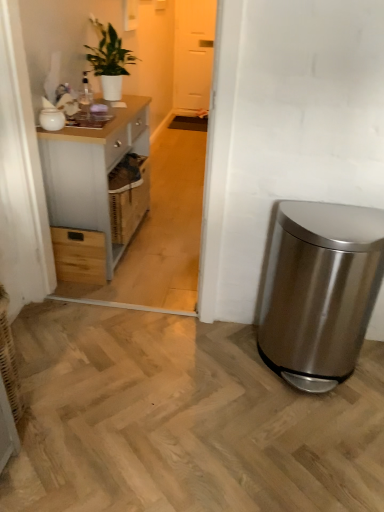
In order to face light gray wood cabinet at left, should I rotate leftwards or rightwards?

Rotate left and turn 11.498 degrees.

Describe the element at coordinates (320, 291) in the screenshot. I see `stainless steel trash can at lower right` at that location.

Locate an element on the screen. Image resolution: width=384 pixels, height=512 pixels. stainless steel trash can at lower right is located at coordinates (320, 291).

The image size is (384, 512). What do you see at coordinates (193, 53) in the screenshot?
I see `transparent glass door at upper center` at bounding box center [193, 53].

You are a GUI agent. You are given a task and a screenshot of the screen. Output one action in this format:
    pyautogui.click(x=<x>, y=<y>)
    Task: Click on the wooden drawer at left
    
    Given the screenshot: What is the action you would take?
    pyautogui.click(x=79, y=255)

I want to click on light gray wood cabinet at left, so click(91, 170).

Is white glossy jar at upper left with wooden drawer at left?

white glossy jar at upper left and wooden drawer at left are clearly separated.

Is point (39, 121) closer or farther from the camera than point (57, 278)?

Point (39, 121) is positioned closer to the camera compared to point (57, 278).

Based on the photo, do you think white glossy jar at upper left is within wooden drawer at left, or outside of it?

The correct answer is: outside.

Based on the photo, in terms of height, does white glossy jar at upper left look taller or shorter compared to wooden drawer at left?

Clearly, white glossy jar at upper left is shorter compared to wooden drawer at left.

What are the coordinates of `appliance that appears above the stainless steel trash can at lower right (from a real-world perspective)` in the screenshot? It's located at (52, 119).

Is stainless steel trash can at lower right not near white glossy jar at upper left?

Indeed, stainless steel trash can at lower right is not near white glossy jar at upper left.

From a real-world perspective, is stainless steel trash can at lower right positioned under white glossy jar at upper left based on gravity?

Indeed, from a real-world perspective, stainless steel trash can at lower right is positioned beneath white glossy jar at upper left.

Is white glossy jar at upper left a part of stainless steel trash can at lower right?

No.

Locate an element on the screen. This screenshot has width=384, height=512. glass door to the right of wooden drawer at left is located at coordinates (193, 53).

From the image's perspective, is transparent glass door at upper center located beneath wooden drawer at left?

No.

Would you consider transparent glass door at upper center to be distant from wooden drawer at left?

transparent glass door at upper center is positioned a significant distance from wooden drawer at left.

Is transparent glass door at upper center thinner than wooden drawer at left?

Correct, the width of transparent glass door at upper center is less than that of wooden drawer at left.

Considering the relative sizes of wooden drawer at left and stainless steel trash can at lower right in the image provided, is wooden drawer at left taller than stainless steel trash can at lower right?

No, wooden drawer at left is not taller than stainless steel trash can at lower right.

Is the surface of wooden drawer at left in direct contact with stainless steel trash can at lower right?

No, wooden drawer at left is not beside stainless steel trash can at lower right.

Based on the photo, from the image's perspective, which one is positioned higher, wooden drawer at left or stainless steel trash can at lower right?

wooden drawer at left is shown above in the image.

Would you consider white glossy jar at upper left to be distant from transparent glass door at upper center?

Indeed, white glossy jar at upper left is not near transparent glass door at upper center.

Is white glossy jar at upper left looking in the opposite direction of transparent glass door at upper center?

No.

Is point (46, 109) closer or farther from the camera than point (197, 36)?

Point (46, 109) appears to be closer to the viewer than point (197, 36).

Considering the relative sizes of green glossy plant at upper left and transparent glass door at upper center in the image provided, is green glossy plant at upper left taller than transparent glass door at upper center?

In fact, green glossy plant at upper left may be shorter than transparent glass door at upper center.

Is green glossy plant at upper left not near transparent glass door at upper center?

That's right, there is a large distance between green glossy plant at upper left and transparent glass door at upper center.

From the image's perspective, which one is positioned lower, green glossy plant at upper left or transparent glass door at upper center?

green glossy plant at upper left is shown below in the image.

From the image's perspective, who appears lower, transparent glass door at upper center or light gray wood cabinet at left?

light gray wood cabinet at left is shown below in the image.

Between transparent glass door at upper center and light gray wood cabinet at left, which one appears on the right side from the viewer's perspective?

transparent glass door at upper center is more to the right.

Is transparent glass door at upper center placed right next to light gray wood cabinet at left?

No, transparent glass door at upper center is not touching light gray wood cabinet at left.

From the picture: Is transparent glass door at upper center facing towards light gray wood cabinet at left?

Yes, transparent glass door at upper center is oriented towards light gray wood cabinet at left.

I want to click on appliance on the left of wooden drawer at left, so [52, 119].

The height and width of the screenshot is (512, 384). Identify the location of appliance that appears behind the stainless steel trash can at lower right. (52, 119).

Based on their spatial positions, is wooden drawer at left or stainless steel trash can at lower right closer to green glossy plant at upper left?

The object closer to green glossy plant at upper left is wooden drawer at left.

Based on their spatial positions, is wooden drawer at left or stainless steel trash can at lower right further from transparent glass door at upper center?

The object further to transparent glass door at upper center is stainless steel trash can at lower right.

When comparing their distances from stainless steel trash can at lower right, does light gray wood cabinet at left or transparent glass door at upper center seem closer?

light gray wood cabinet at left is closer to stainless steel trash can at lower right.

Considering their positions, is transparent glass door at upper center positioned further to wooden drawer at left than stainless steel trash can at lower right?

A: transparent glass door at upper center is positioned further to the anchor wooden drawer at left.

From the image, which object appears to be farther from stainless steel trash can at lower right, white glossy jar at upper left or wooden drawer at left?

white glossy jar at upper left lies further to stainless steel trash can at lower right than the other object.

Looking at the image, which one is located further to light gray wood cabinet at left, white glossy jar at upper left or stainless steel trash can at lower right?

stainless steel trash can at lower right.

Estimate the real-world distances between objects in this image. Which object is further from transparent glass door at upper center, wooden drawer at left or green glossy plant at upper left?

The object further to transparent glass door at upper center is wooden drawer at left.

When comparing their distances from wooden drawer at left, does green glossy plant at upper left or light gray wood cabinet at left seem closer?

light gray wood cabinet at left is closer to wooden drawer at left.

Locate an element on the screen. The image size is (384, 512). cabinetry between white glossy jar at upper left and stainless steel trash can at lower right from left to right is located at coordinates coord(91,170).

The height and width of the screenshot is (512, 384). Find the location of `drawer between white glossy jar at upper left and stainless steel trash can at lower right in the horizontal direction`. drawer between white glossy jar at upper left and stainless steel trash can at lower right in the horizontal direction is located at coordinates (79, 255).

Where is `houseplant located between stainless steel trash can at lower right and transparent glass door at upper center in the depth direction`? houseplant located between stainless steel trash can at lower right and transparent glass door at upper center in the depth direction is located at coordinates (109, 60).

At what (x,y) coordinates should I click in order to perform the action: click on appliance between green glossy plant at upper left and wooden drawer at left in the vertical direction. Please return your answer as a coordinate pair (x, y). Looking at the image, I should click on (52, 119).